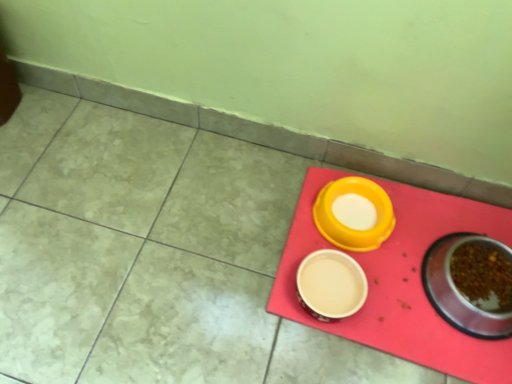
At what (x,y) coordinates should I click in order to perform the action: click on vacant space in front of yellow plastic bowl at center, which appears as the 2th tableware when viewed from the left. Please return your answer as a coordinate pair (x, y). Image resolution: width=512 pixels, height=384 pixels. Looking at the image, I should click on (362, 311).